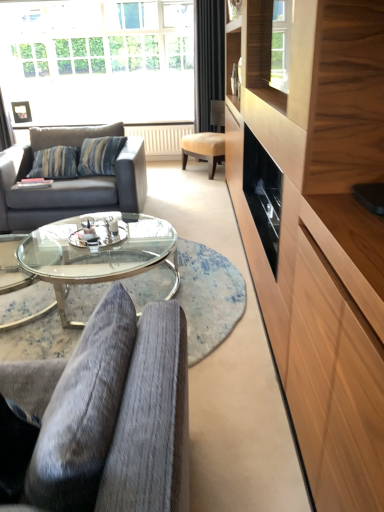
What do you see at coordinates (98, 252) in the screenshot?
I see `transparent glass coffee table at center` at bounding box center [98, 252].

Consider the image. What is the approximate height of velvet grey armchair at center, acting as the 1th chair starting from the left?

velvet grey armchair at center, acting as the 1th chair starting from the left, is 13.71 inches in height.

This screenshot has height=512, width=384. What are the coordinates of `velvet grey armchair at center, the 2th chair when ordered from top to bottom` in the screenshot? It's located at (104, 415).

Locate an element on the screen. transparent glass window at upper center is located at coordinates point(99,61).

The width and height of the screenshot is (384, 512). What do you see at coordinates (319, 232) in the screenshot? I see `wooden cabinet at right` at bounding box center [319, 232].

This screenshot has width=384, height=512. What do you see at coordinates (208, 60) in the screenshot?
I see `black velvet curtain at upper center` at bounding box center [208, 60].

Image resolution: width=384 pixels, height=512 pixels. In order to click on transparent glass coffee table at center in this screenshot , I will do `click(98, 252)`.

Is velvet grey armchair at center, the 1th chair in the bottom-to-top sequence, outside of beige leather chair at center, the first chair positioned from the back?

Yes.

Which object is positioned more to the left, velvet grey armchair at center, which appears as the second chair when viewed from the back, or beige leather chair at center, the second chair when ordered from bottom to top?

velvet grey armchair at center, which appears as the second chair when viewed from the back.

Considering the positions of point (59, 403) and point (215, 104), is point (59, 403) closer or farther from the camera than point (215, 104)?

Point (59, 403) is positioned closer to the camera compared to point (215, 104).

From a real-world perspective, between velvet grey armchair at center, acting as the 1th chair starting from the left, and beige leather chair at center, the 1th chair positioned from the top, who is vertically higher?

velvet grey armchair at center, acting as the 1th chair starting from the left.

Does beige leather chair at center, the second chair when ordered from bottom to top, have a greater height compared to wooden cabinet at right?

No, beige leather chair at center, the second chair when ordered from bottom to top, is not taller than wooden cabinet at right.

Is beige leather chair at center, the second chair when ordered from bottom to top, at the right side of wooden cabinet at right?

Incorrect, beige leather chair at center, the second chair when ordered from bottom to top, is not on the right side of wooden cabinet at right.

Which is nearer, (210, 179) or (309, 62)?

Point (210, 179) appears to be farther away from the viewer than point (309, 62).

Is beige leather chair at center, the second chair when ordered from bottom to top, not close to wooden cabinet at right?

beige leather chair at center, the second chair when ordered from bottom to top, is positioned a significant distance from wooden cabinet at right.

Between beige leather chair at center, the second chair when ordered from bottom to top, and transparent glass window at upper center, which one has less height?

beige leather chair at center, the second chair when ordered from bottom to top, is shorter.

Would you say beige leather chair at center, the 1th chair positioned from the top, is inside or outside transparent glass window at upper center?

beige leather chair at center, the 1th chair positioned from the top, is located beyond the bounds of transparent glass window at upper center.

Are beige leather chair at center, arranged as the first chair when viewed from the right, and transparent glass window at upper center far apart?

Yes, beige leather chair at center, arranged as the first chair when viewed from the right, and transparent glass window at upper center are quite far apart.

In the image, is beige leather chair at center, the 1th chair positioned from the top, on the left side or the right side of transparent glass window at upper center?

In the image, beige leather chair at center, the 1th chair positioned from the top, appears on the right side of transparent glass window at upper center.

Is gray fabric couch at left located within velvet grey armchair at center, the 1th chair in the bottom-to-top sequence?

No, gray fabric couch at left is located outside of velvet grey armchair at center, the 1th chair in the bottom-to-top sequence.

Which object is positioned more to the left, velvet grey armchair at center, the 1th chair viewed from the front, or gray fabric couch at left?

gray fabric couch at left is more to the left.

Consider the image. Is gray fabric couch at left at the back of velvet grey armchair at center, the 1th chair viewed from the front?

No, velvet grey armchair at center, the 1th chair viewed from the front,'s orientation is not away from gray fabric couch at left.

Is velvet grey armchair at center, acting as the 1th chair starting from the left, beside gray fabric couch at left?

They are not placed beside each other.

From the image's perspective, which one is positioned lower, gray fabric couch at left or transparent glass window at upper center?

gray fabric couch at left is shown below in the image.

Considering the positions of points (129, 139) and (92, 62), is point (129, 139) closer to camera compared to point (92, 62)?

Yes.

Find the location of a particular element. The height and width of the screenshot is (512, 384). window above the gray fabric couch at left (from the image's perspective) is located at coordinates (99, 61).

Based on the photo, can you see gray fabric couch at left touching transparent glass window at upper center?

gray fabric couch at left and transparent glass window at upper center are not in contact.

Who is bigger, wooden cabinet at right or velvet grey armchair at center, the 2th chair when ordered from top to bottom?

wooden cabinet at right is bigger.

Based on the photo, from a real-world perspective, is wooden cabinet at right positioned over velvet grey armchair at center, the 2th chair positioned from the right, based on gravity?

Yes, from a real-world perspective, wooden cabinet at right is on top of velvet grey armchair at center, the 2th chair positioned from the right.

Starting from the wooden cabinet at right, which chair is the 1st one behind? Please provide its 2D coordinates.

[(104, 415)]

From the picture: Does transparent glass window at upper center have a lesser width compared to velvet grey armchair at center, which appears as the second chair when viewed from the back?

Yes.

Can you confirm if transparent glass window at upper center is bigger than velvet grey armchair at center, the 2th chair when ordered from top to bottom?

Yes, transparent glass window at upper center is bigger than velvet grey armchair at center, the 2th chair when ordered from top to bottom.

Is transparent glass window at upper center turned away from velvet grey armchair at center, the 2th chair positioned from the right?

No, transparent glass window at upper center's orientation is not away from velvet grey armchair at center, the 2th chair positioned from the right.

From the image's perspective, is transparent glass window at upper center above velvet grey armchair at center, the 2th chair positioned from the right?

Yes, from the image's perspective, transparent glass window at upper center is on top of velvet grey armchair at center, the 2th chair positioned from the right.

This screenshot has height=512, width=384. Identify the location of chair that appears on the left of beige leather chair at center, the second chair when ordered from bottom to top. (104, 415).

In the image, there is a wooden cabinet at right. Identify the location of chair above it (from the image's perspective). Image resolution: width=384 pixels, height=512 pixels. (207, 141).

Estimate the real-world distances between objects in this image. Which object is further from black velvet curtain at upper center, transparent glass window at upper center or velvet grey armchair at center, the 1th chair in the bottom-to-top sequence?

Among the two, velvet grey armchair at center, the 1th chair in the bottom-to-top sequence, is located further to black velvet curtain at upper center.

Looking at the image, which one is located closer to wooden cabinet at right, transparent glass coffee table at center or black velvet curtain at upper center?

Based on the image, transparent glass coffee table at center appears to be nearer to wooden cabinet at right.

Considering their positions, is transparent glass coffee table at center positioned further to transparent glass window at upper center than black velvet curtain at upper center?

transparent glass coffee table at center is further to transparent glass window at upper center.

Which object lies nearer to the anchor point black velvet curtain at upper center, transparent glass coffee table at center or velvet grey armchair at center, the 2th chair when ordered from top to bottom?

transparent glass coffee table at center is closer to black velvet curtain at upper center.

Which object lies further to the anchor point velvet grey armchair at center, the 1th chair in the bottom-to-top sequence, black velvet curtain at upper center or gray fabric couch at left?

Among the two, black velvet curtain at upper center is located further to velvet grey armchair at center, the 1th chair in the bottom-to-top sequence.

From the image, which object appears to be farther from black velvet curtain at upper center, wooden cabinet at right or transparent glass window at upper center?

wooden cabinet at right.

Which object lies nearer to the anchor point transparent glass window at upper center, black velvet curtain at upper center or velvet grey armchair at center, acting as the 1th chair starting from the left?

black velvet curtain at upper center lies closer to transparent glass window at upper center than the other object.

Looking at the image, which one is located further to gray fabric couch at left, black velvet curtain at upper center or transparent glass window at upper center?

black velvet curtain at upper center.

Locate an element on the screen. chair between gray fabric couch at left and transparent glass window at upper center from front to back is located at coordinates (207, 141).

Where is `studio couch between wooden cabinet at right and black velvet curtain at upper center in the front-back direction`? The width and height of the screenshot is (384, 512). studio couch between wooden cabinet at right and black velvet curtain at upper center in the front-back direction is located at coordinates (70, 180).

This screenshot has height=512, width=384. Identify the location of chair between velvet grey armchair at center, the 2th chair positioned from the right, and black velvet curtain at upper center in the front-back direction. (207, 141).

Image resolution: width=384 pixels, height=512 pixels. What are the coordinates of `chair between transparent glass coffee table at center and black velvet curtain at upper center from front to back` in the screenshot? It's located at (207, 141).